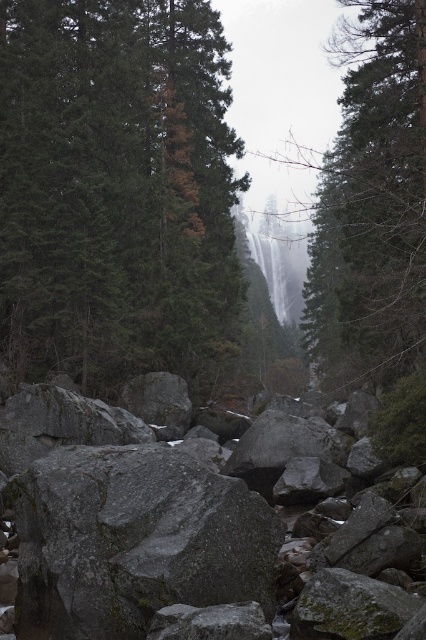
Does gray granite rocks at lower center have a lesser width compared to gray rough rock at center?

No, gray granite rocks at lower center is not thinner than gray rough rock at center.

Does point (144, 557) lie in front of point (149, 492)?

Yes, point (144, 557) is closer to viewer.

Locate an element on the screen. This screenshot has height=640, width=426. gray granite rocks at lower center is located at coordinates (201, 532).

Is point (252, 484) more distant than point (330, 296)?

No, (252, 484) is in front of (330, 296).

Where is `gray granite rocks at lower center`? The width and height of the screenshot is (426, 640). gray granite rocks at lower center is located at coordinates (201, 532).

Can you confirm if green matte tree at upper left is taller than green matte tree at upper center?

In fact, green matte tree at upper left may be shorter than green matte tree at upper center.

Does point (226, 195) lie in front of point (336, 179)?

Yes, point (226, 195) is in front of point (336, 179).

Identify the location of green matte tree at upper left. The width and height of the screenshot is (426, 640). (117, 189).

This screenshot has width=426, height=640. I want to click on green matte tree at upper left, so 117,189.